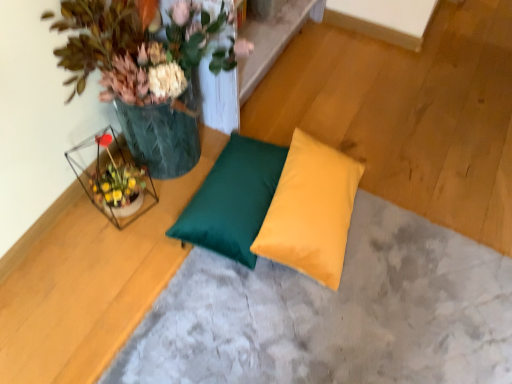
Image resolution: width=512 pixels, height=384 pixels. In order to click on unoccupied area in front of yellow satin pillow at center, marked as the second pillow in a left-to-right arrangement in this screenshot , I will do `click(317, 336)`.